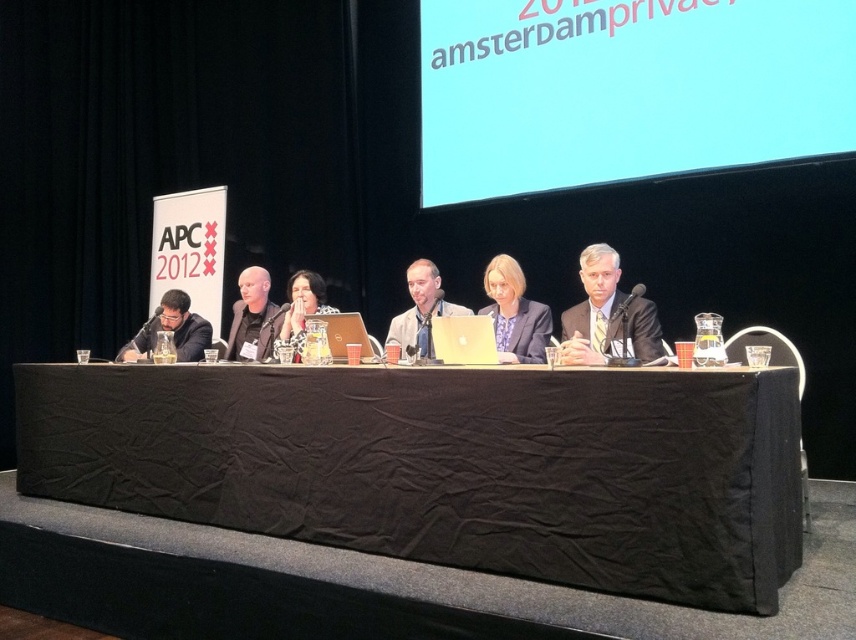
You are standing at the back of the stage and want to walk to the point that is closer to the front. Which point should you go to, point (263, 349) or point (179, 323)?

Point (263, 349) is in front of point (179, 323), so you should go to point (263, 349) since it is closer to the front.

Consider the image. You are a photographer standing behind the panelists at the Amsterdam event. You need to capture a photo where both the matte black shirt at center and the silver metallic laptop at center are in focus. Given that your camera can only sharply focus on objects within a 1.5 meter range, will both items be in focus?

The matte black shirt at center is 1.42 meters from the silver metallic laptop at center. Since the distance between them is within the camera focus range of 1.5 meters, both items will be in focus.